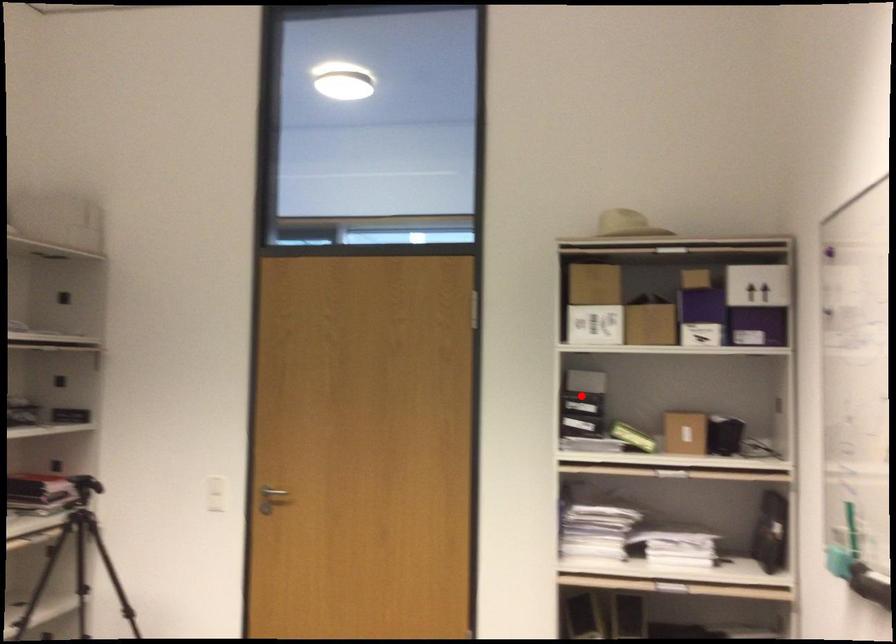
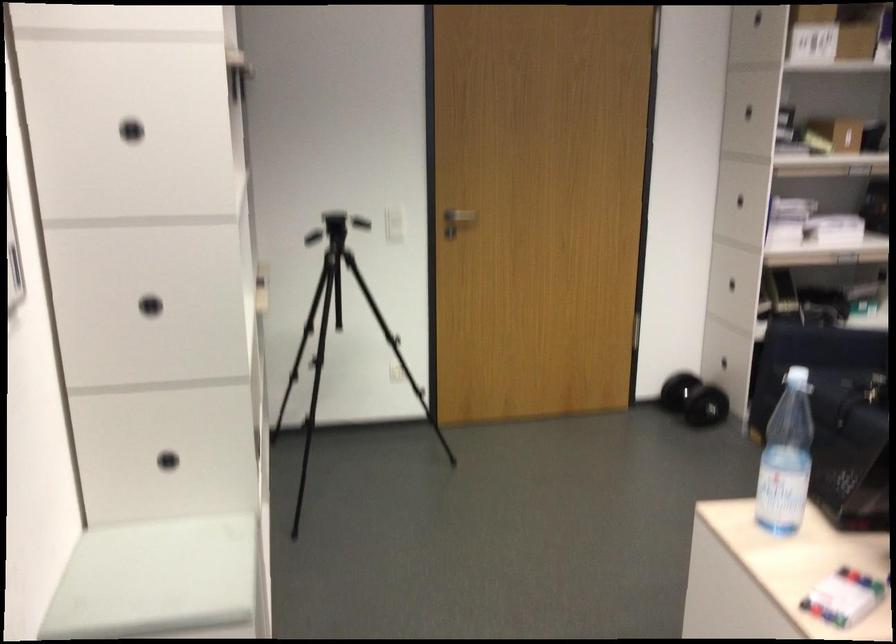
Find the pixel in the second image that matches the highlighted location in the first image.

(747, 111)